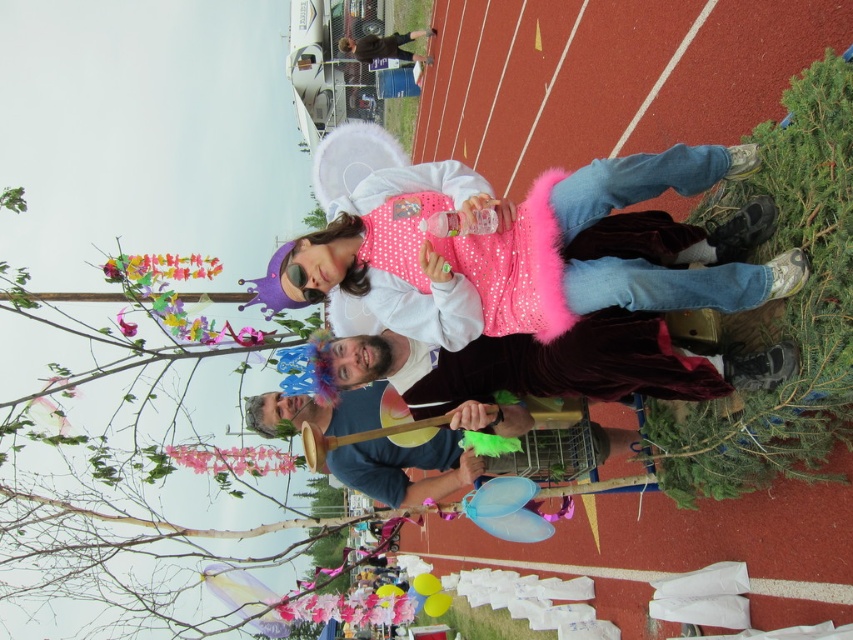
Question: Which of the following is the closest to the observer?

Choices:
 (A) (820, 364)
 (B) (424, 339)
 (C) (25, 410)
 (D) (465, 356)

Answer: (A)

Question: From the image, what is the correct spatial relationship of pink paper tree at upper center in relation to pink fluffy tutu at center?

Choices:
 (A) left
 (B) right

Answer: (A)

Question: Can you confirm if pink fluffy tutu at center is positioned below green leafy tree at lower right?

Choices:
 (A) no
 (B) yes

Answer: (A)

Question: Which point is closer to the camera?

Choices:
 (A) (820, 474)
 (B) (285, 577)

Answer: (A)

Question: Based on their relative distances, which object is farther from the pink fluffy tutu at center?

Choices:
 (A) pink paper tree at upper center
 (B) velvet maroon cape at center
 (C) green leafy tree at lower right

Answer: (A)

Question: Considering the relative positions of pink paper tree at upper center and pink fluffy tutu at center in the image provided, where is pink paper tree at upper center located with respect to pink fluffy tutu at center?

Choices:
 (A) right
 (B) left

Answer: (B)